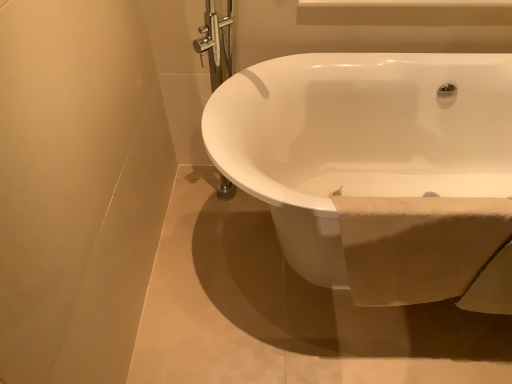
Question: Are white soft towel at lower right and white glossy bathtub at center far apart?

Choices:
 (A) no
 (B) yes

Answer: (A)

Question: Is white soft towel at lower right in front of white glossy bathtub at center?

Choices:
 (A) yes
 (B) no

Answer: (B)

Question: Is white soft towel at lower right looking in the opposite direction of white glossy bathtub at center?

Choices:
 (A) yes
 (B) no

Answer: (A)

Question: Is white soft towel at lower right wider than white glossy bathtub at center?

Choices:
 (A) yes
 (B) no

Answer: (B)

Question: Is white soft towel at lower right bigger than white glossy bathtub at center?

Choices:
 (A) yes
 (B) no

Answer: (B)

Question: From the image's perspective, does white soft towel at lower right appear lower than white glossy bathtub at center?

Choices:
 (A) no
 (B) yes

Answer: (B)

Question: Can you confirm if white glossy bathtub at center is thinner than white soft towel at lower right?

Choices:
 (A) no
 (B) yes

Answer: (A)

Question: Is white glossy bathtub at center outside white soft towel at lower right?

Choices:
 (A) no
 (B) yes

Answer: (B)

Question: From the image's perspective, is white glossy bathtub at center under white soft towel at lower right?

Choices:
 (A) no
 (B) yes

Answer: (A)

Question: Is white glossy bathtub at center surrounding white soft towel at lower right?

Choices:
 (A) no
 (B) yes

Answer: (B)

Question: Is white glossy bathtub at center taller than white soft towel at lower right?

Choices:
 (A) no
 (B) yes

Answer: (B)

Question: From a real-world perspective, is white glossy bathtub at center located higher than white soft towel at lower right?

Choices:
 (A) yes
 (B) no

Answer: (B)

Question: Considering the relative positions of white glossy bathtub at center and white soft towel at lower right in the image provided, is white glossy bathtub at center to the left or to the right of white soft towel at lower right?

Choices:
 (A) right
 (B) left

Answer: (A)